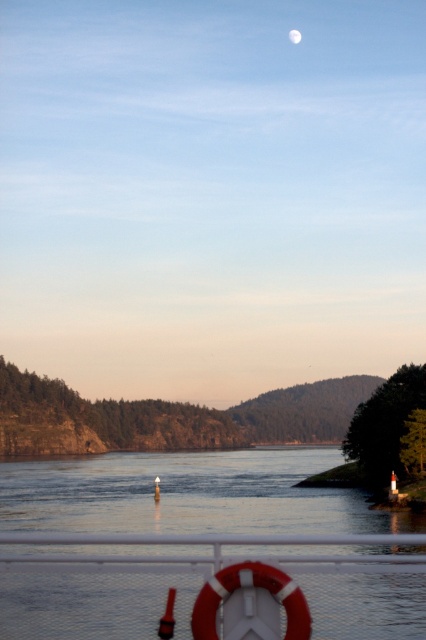
You are standing on a boat and see the white plastic lifebuoy at lower center and the silvery reflective moon at upper center. Which object is positioned higher in the image?

The silvery reflective moon at upper center is positioned higher in the image than the white plastic lifebuoy at lower center.

You are standing at the riverside and see the white plastic lifebuoy at lower center and the silvery reflective moon at upper center. Which object is positioned to the left when viewed from your perspective?

The white plastic lifebuoy at lower center is positioned to the left of the silvery reflective moon at upper center.